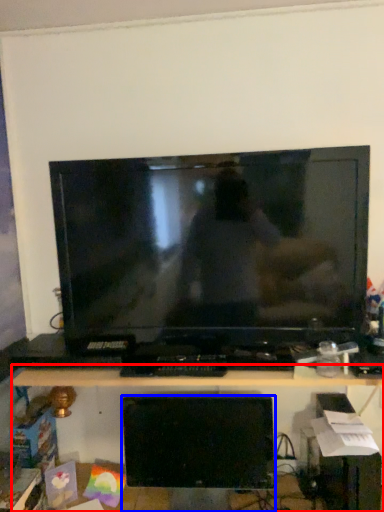
Question: Which object is further to the camera taking this photo, desk (highlighted by a red box) or computer monitor (highlighted by a blue box)?

Choices:
 (A) desk
 (B) computer monitor

Answer: (B)